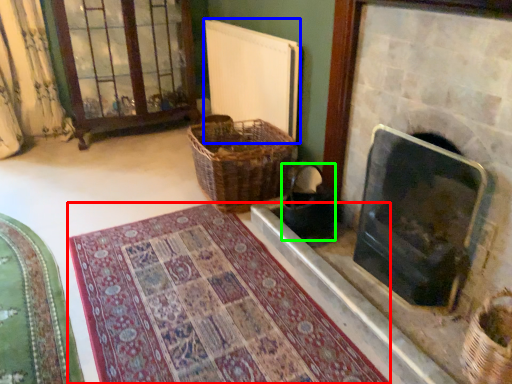
Question: Which is nearer to the mat (highlighted by a red box)? radiator (highlighted by a blue box) or laundry basket (highlighted by a green box).

Choices:
 (A) radiator
 (B) laundry basket

Answer: (B)